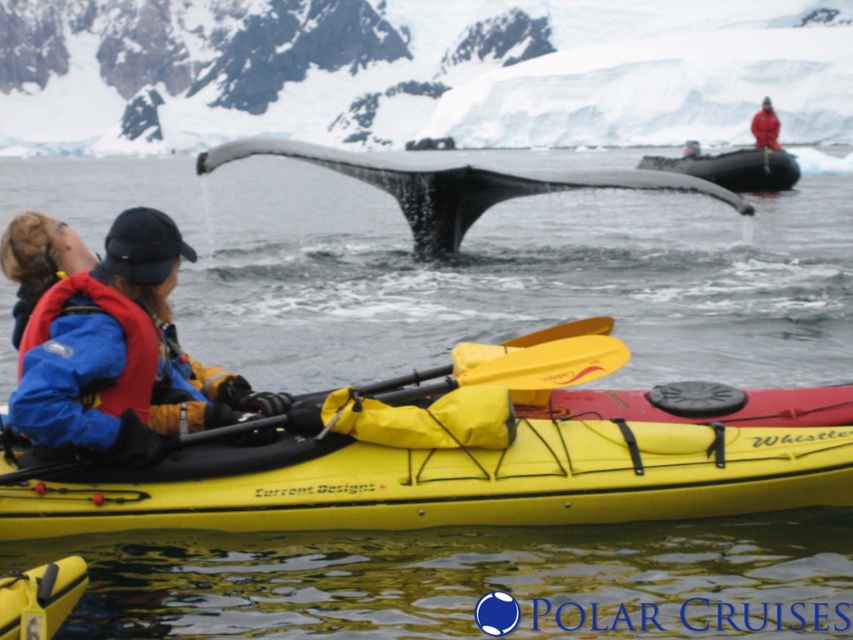
You are navigating a kayak in a polar environment and see two points on your GPS. The first point is labeled as point 1 at coordinates point (238,141) and the second point is labeled as point 2 at coordinates point (750,186). Based on the scene, which point is closer to your current position in the kayak?

Point (238,141) is closer to your current position in the kayak because it is in front of point (750,186).

You are a wildlife photographer on a boat near the gray smooth whale tail at center. Your boat is 10 meters long. You want to move closer to the whale tail to take a better photo. The minimum safe distance recommended by marine biologists is 100 meters. Is it safe to approach the whale tail at center now?

The gray smooth whale tail at center is 66.59 meters away from the viewer. Since the minimum safe distance is 100 meters, approaching to within 66.59 meters would be unsafe. You should maintain a distance of at least 100 meters for safety.

You are a photographer trying to capture the whale tail in the image. You notice two points marked on your screen. The first point is at coordinates point (422, 374) and the second point is at coordinates point (798, 164). Which point is closer to the camera and thus likely part of the whale tail that is nearer to you?

Point (422, 374) is closer to the camera than point (798, 164), so it is likely part of the whale tail that is nearer to you.